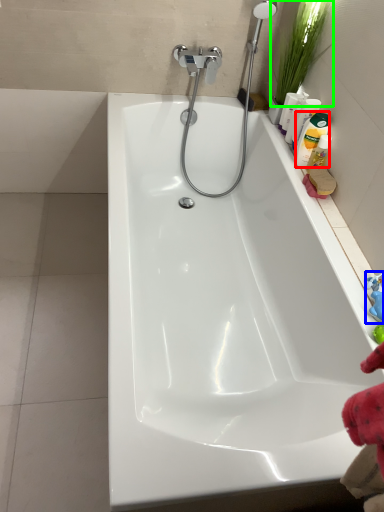
Question: Considering the real-world distances, which object is closest to cleaning product (highlighted by a red box)? toy (highlighted by a blue box) or plant (highlighted by a green box).

Choices:
 (A) toy
 (B) plant

Answer: (B)